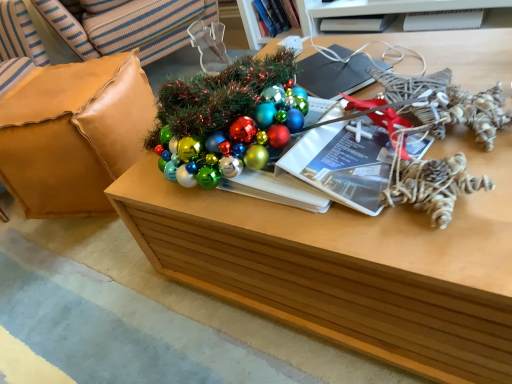
Identify the location of free spot in front of twisted rope ornament at right. This screenshot has height=384, width=512. (467, 251).